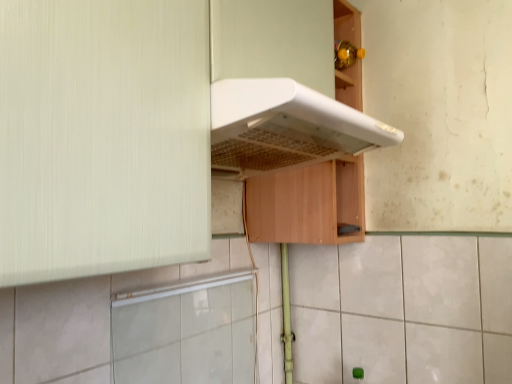
Locate an element on the screen. white matte exhaust hood at upper center is located at coordinates (286, 126).

Measure the distance between point (x=356, y=144) and camera.

Point (x=356, y=144) and camera are 1.06 meters apart.

The width and height of the screenshot is (512, 384). What do you see at coordinates (286, 126) in the screenshot?
I see `white matte exhaust hood at upper center` at bounding box center [286, 126].

The height and width of the screenshot is (384, 512). I want to click on white matte exhaust hood at upper center, so pos(286,126).